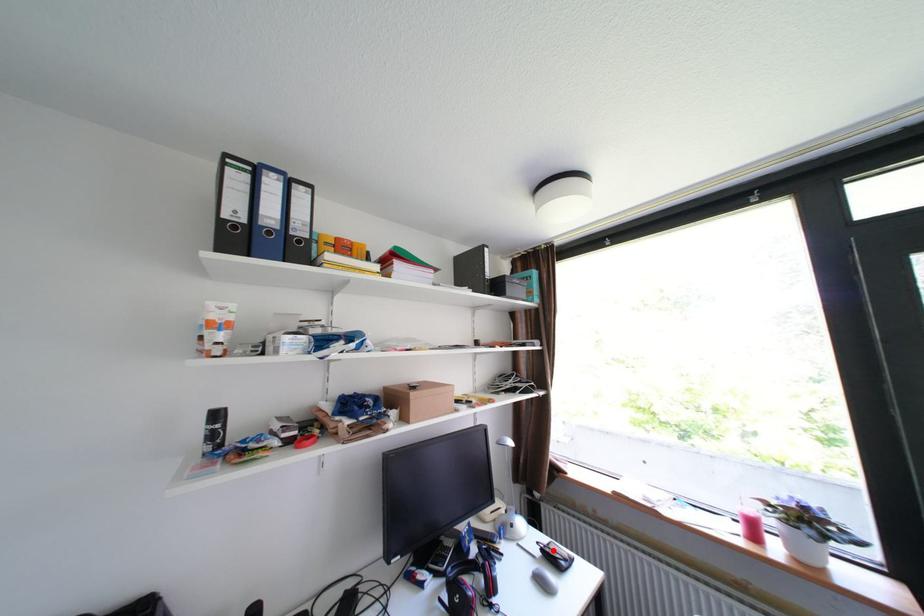
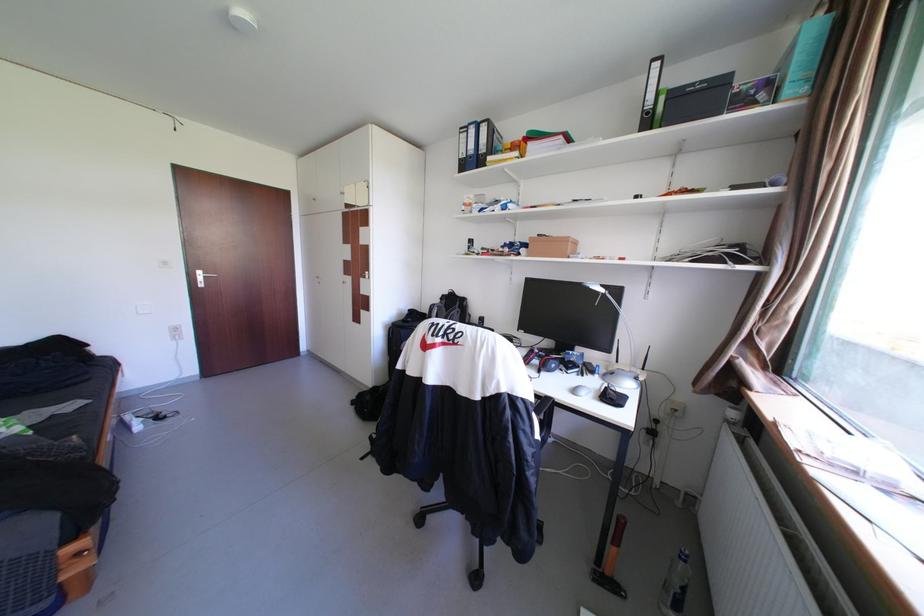
Question: I am providing you with two images of the same scene from different viewpoints. A red point is marked on the first image. Can you still see the location of the red point in image 2?

Choices:
 (A) Yes
 (B) No

Answer: (B)